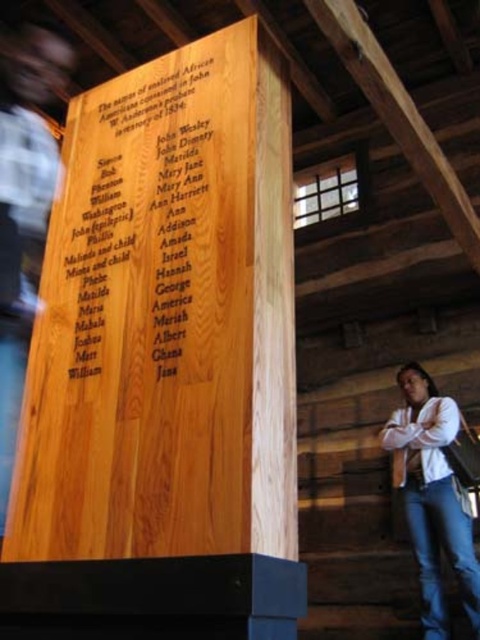
Based on the photo, can you confirm if wooden plaque at center is positioned to the left of light brown wood man at left?

No, wooden plaque at center is not to the left of light brown wood man at left.

Which is more to the left, wooden plaque at center or light brown wood man at left?

light brown wood man at left is more to the left.

Measure the distance between wooden plaque at center and camera.

wooden plaque at center is 1.65 meters away from camera.

Where is `wooden plaque at center`? The width and height of the screenshot is (480, 640). wooden plaque at center is located at coordinates (132, 212).

Who is more forward, (12, 244) or (425, 433)?

Point (12, 244) is in front.

Is point (40, 163) less distant than point (437, 436)?

That is True.

Measure the distance between point (39, 225) and camera.

Point (39, 225) is 2.19 meters from camera.

Identify the location of light brown wood man at left. (23, 209).

Is wooden plaque at center below white shirt at lower right?

Incorrect, wooden plaque at center is not positioned below white shirt at lower right.

Is point (197, 81) closer to camera compared to point (395, 476)?

That is True.

Which is in front, point (99, 355) or point (404, 504)?

Positioned in front is point (99, 355).

Find the location of a particular element. This screenshot has width=480, height=640. wooden plaque at center is located at coordinates (132, 212).